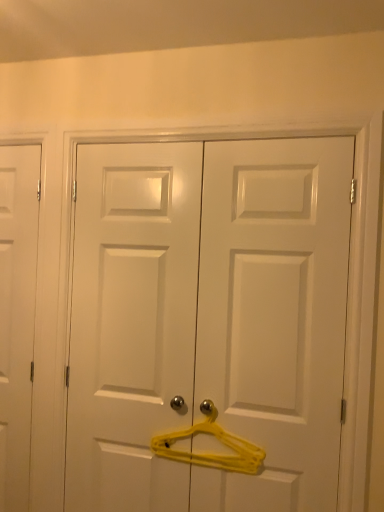
Question: Which is correct: yellow plastic hanger at center is inside white matte door at left, the first door when ordered from back to front, or outside of it?

Choices:
 (A) inside
 (B) outside

Answer: (B)

Question: Is yellow plastic hanger at center wider or thinner than white matte door at left, which is the 2th door from right to left?

Choices:
 (A) wide
 (B) thin

Answer: (B)

Question: Which is farther from the white matte door at left, which is the 2th door from right to left?

Choices:
 (A) yellow plastic hanger at center
 (B) white glossy door at center, arranged as the 2th door when viewed from the left

Answer: (A)

Question: Which object is the farthest from the white matte door at left, which is the 2th door from right to left?

Choices:
 (A) white glossy door at center, placed as the 1th door when sorted from right to left
 (B) yellow plastic hanger at center

Answer: (B)